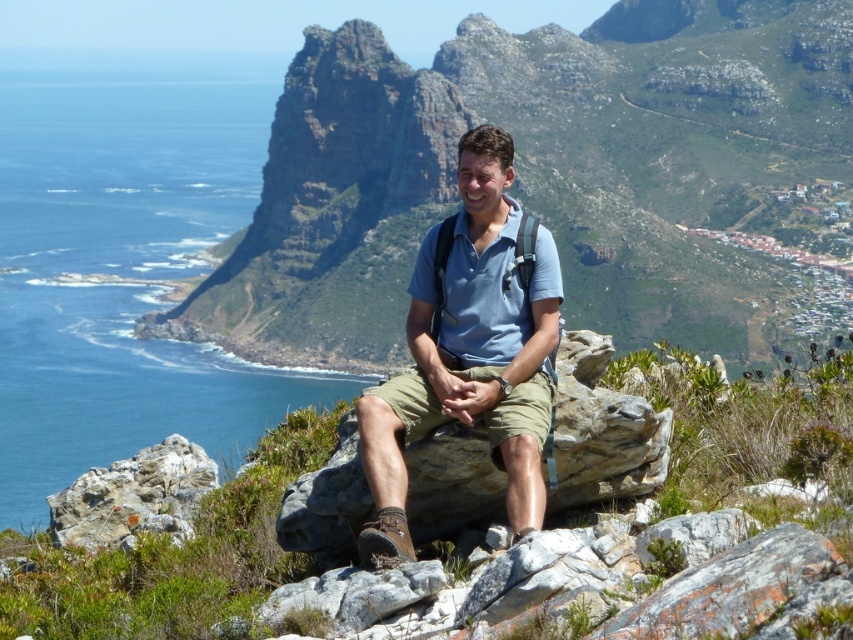
You are a hiker trying to reach the rugged rock formation at center from the rough textured rock at lower left. Which direction should you move to get there?

The rough textured rock at lower left is behind the rugged rock formation at center, so to reach the rugged rock formation at center, you should move forward towards it from the rough textured rock at lower left.

You are a hiker who wants to take a photo of the blue water at left and the rough textured rock at lower left. Which object is higher in the image?

The blue water at left is above the rough textured rock at lower left, so the blue water at left is higher in the image.

You are a hiker who wants to take a photo of the rugged rock formation at center and the blue cotton shirt at center from a lower position. Can you do this without moving the objects?

The rugged rock formation at center is located above the blue cotton shirt at center, so if you position yourself lower than the blue cotton shirt at center, you can capture both in your photo without moving the objects.